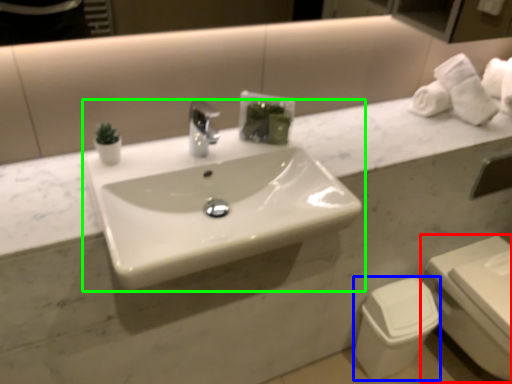
Question: Considering the real-world distances, which object is farthest from toilet (highlighted by a red box)? toilet bowl (highlighted by a blue box) or sink (highlighted by a green box)?

Choices:
 (A) toilet bowl
 (B) sink

Answer: (B)